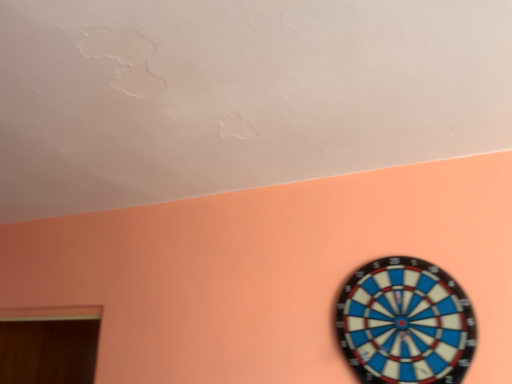
Question: Can you confirm if blue plastic dartboard at lower right is wider than wooden door at lower left?

Choices:
 (A) no
 (B) yes

Answer: (A)

Question: Would you say blue plastic dartboard at lower right is a long distance from wooden door at lower left?

Choices:
 (A) yes
 (B) no

Answer: (A)

Question: From the image's perspective, would you say blue plastic dartboard at lower right is positioned over wooden door at lower left?

Choices:
 (A) no
 (B) yes

Answer: (B)

Question: From a real-world perspective, is blue plastic dartboard at lower right physically above wooden door at lower left?

Choices:
 (A) yes
 (B) no

Answer: (A)

Question: From a real-world perspective, is blue plastic dartboard at lower right positioned under wooden door at lower left based on gravity?

Choices:
 (A) yes
 (B) no

Answer: (B)

Question: Is blue plastic dartboard at lower right to the left of wooden door at lower left from the viewer's perspective?

Choices:
 (A) yes
 (B) no

Answer: (B)

Question: Is blue plastic dartboard at lower right completely or partially inside wooden door at lower left?

Choices:
 (A) yes
 (B) no

Answer: (B)

Question: Could you tell me if wooden door at lower left is facing blue plastic dartboard at lower right?

Choices:
 (A) yes
 (B) no

Answer: (A)

Question: Does wooden door at lower left have a smaller size compared to blue plastic dartboard at lower right?

Choices:
 (A) yes
 (B) no

Answer: (B)

Question: Considering the relative sizes of wooden door at lower left and blue plastic dartboard at lower right in the image provided, is wooden door at lower left taller than blue plastic dartboard at lower right?

Choices:
 (A) yes
 (B) no

Answer: (A)

Question: Is there a large distance between wooden door at lower left and blue plastic dartboard at lower right?

Choices:
 (A) no
 (B) yes

Answer: (B)

Question: From the image's perspective, is wooden door at lower left located beneath blue plastic dartboard at lower right?

Choices:
 (A) no
 (B) yes

Answer: (B)

Question: From a real-world perspective, is wooden door at lower left positioned above or below blue plastic dartboard at lower right?

Choices:
 (A) above
 (B) below

Answer: (B)